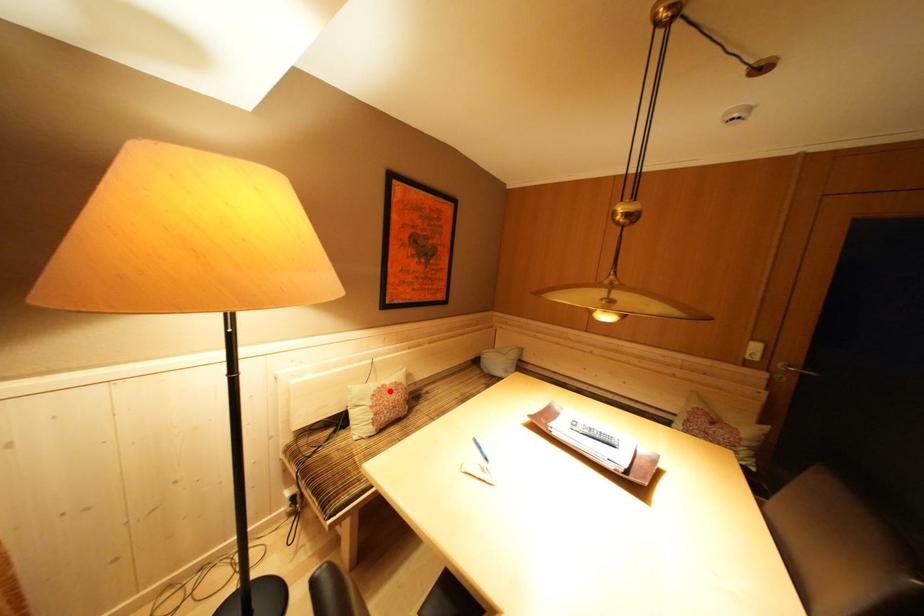
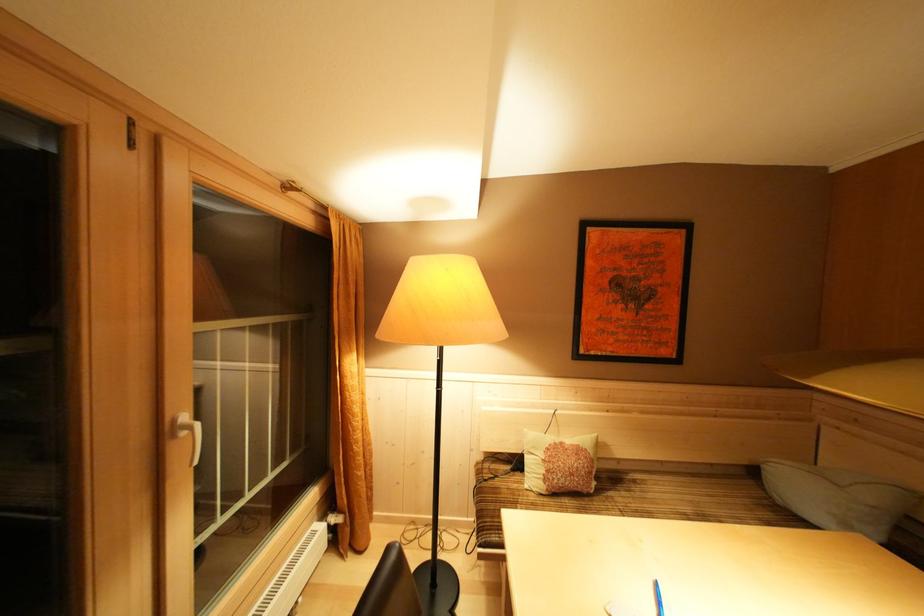
Question: I am providing you with two images of the same scene from different viewpoints. Given a red point in image1, look at the same physical point in image2. Is it:

Choices:
 (A) Closer to the viewpoint
 (B) Farther from the viewpoint

Answer: (B)